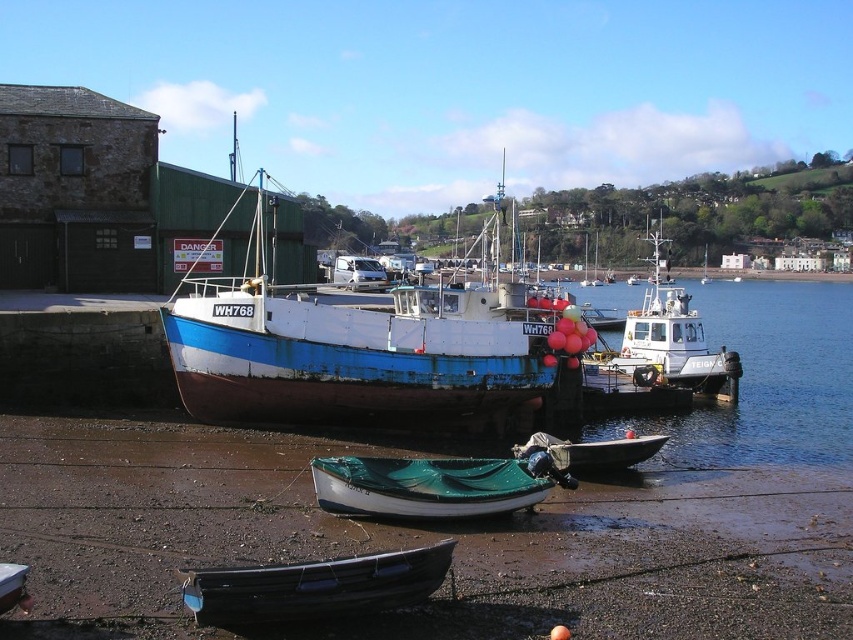
Consider the image. You are standing on the wooden dock and want to board the blue painted wooden boat at center. Which direction should you move relative to the green tarpaulin boat at lower center?

The blue painted wooden boat at center is above the green tarpaulin boat at lower center, so you should move upward from the green tarpaulin boat at lower center to reach the blue painted wooden boat at center.